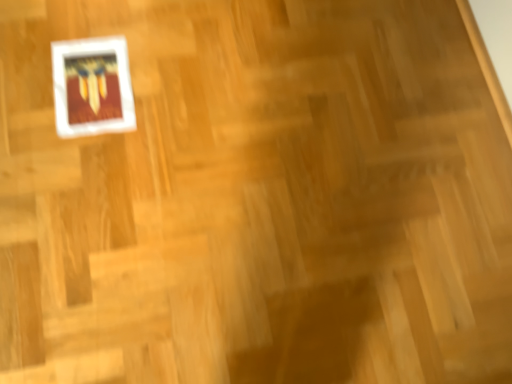
Describe the element at coordinates (92, 87) in the screenshot. The height and width of the screenshot is (384, 512). I see `white glossy picture frame at upper left` at that location.

The image size is (512, 384). In order to click on white glossy picture frame at upper left in this screenshot , I will do `click(92, 87)`.

Locate an element on the screen. The width and height of the screenshot is (512, 384). white glossy picture frame at upper left is located at coordinates (92, 87).